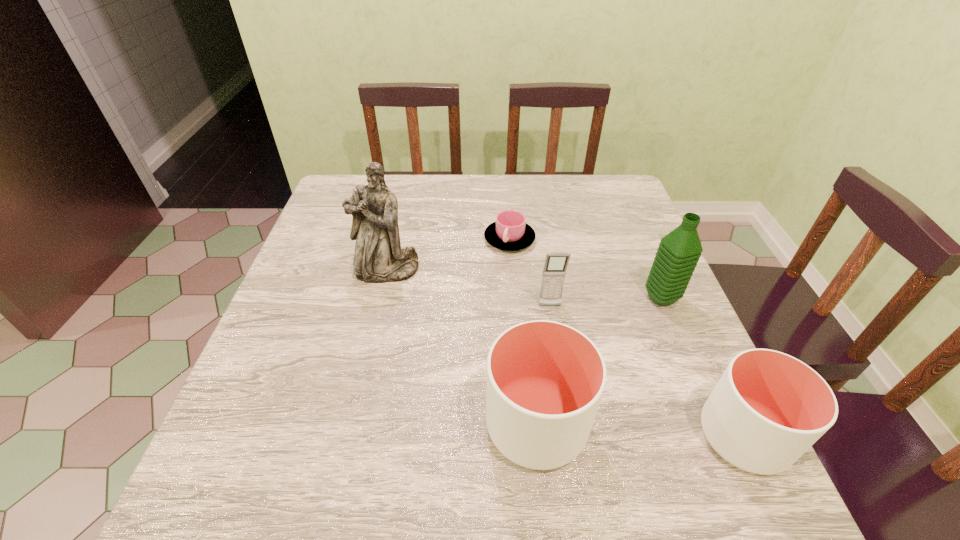
Given the evenly spaced cups in the image, where should an extra cup be added on the left to preserve the spacing? Please point to a vacant space. Please provide its 2D coordinates. Your answer should be formatted as a tuple, i.e. [(x, y)], where the tuple contains the x and y coordinates of a point satisfying the conditions above.

[(338, 414)]